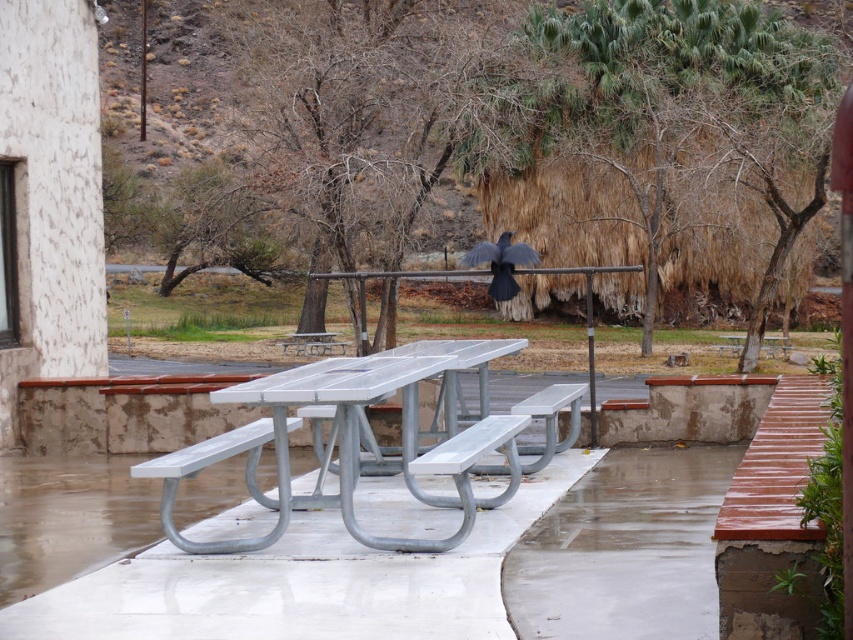
You are planning to set up a picnic and need to place a large blanket under the metallic silver picnic table at center and the metallic silver bench at center. Based on the scene, can you determine if there is enough space between the picnic table and the bench to spread the blanket?

The metallic silver picnic table at center is positioned over the metallic silver bench at center, meaning there is no space between them. Therefore, you cannot spread the blanket between the metallic silver picnic table at center and the metallic silver bench at center.

You are standing at the picnic area and want to place a small umbrella on the metallic silver picnic table at center. The point where you want to place the umbrella is at coordinates point (358, 426). Is this point on the metallic silver picnic table at center?

Yes, the point (358, 426) is on the metallic silver picnic table at center, so you can place the umbrella there.

You are planning to set up a picnic and need to place a large basket on the metallic silver picnic table at center and a small cooler on the metallic silver bench at center. Considering their sizes, which object can accommodate the item placed on it without the item hanging over the edges?

The metallic silver picnic table at center has a larger size compared to the metallic silver bench at center, so the large basket can fit on the picnic table without hanging over the edges, and the small cooler can also fit on the bench.